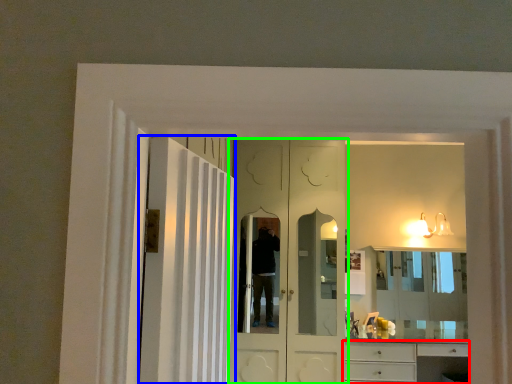
Question: Considering the real-world distances, which object is farthest from cabinetry (highlighted by a red box)? door (highlighted by a blue box) or door (highlighted by a green box)?

Choices:
 (A) door
 (B) door

Answer: (A)